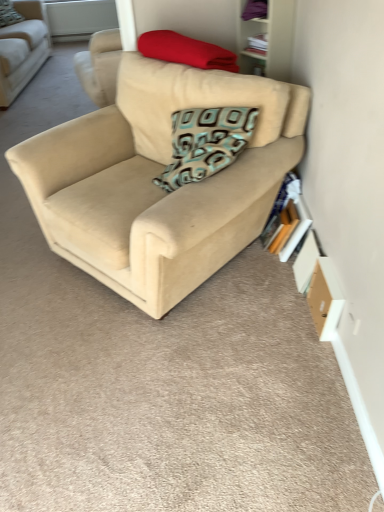
Describe the element at coordinates (186, 51) in the screenshot. This screenshot has width=384, height=512. I see `matte red blanket at upper center, which appears as the 1th pillow when viewed from the front` at that location.

Measure the distance between point (284,253) and camera.

7.11 feet.

At what (x,y) coordinates should I click in order to perform the action: click on beige fabric couch at center, acting as the first studio couch starting from the bottom. Please return your answer as a coordinate pair (x, y). The width and height of the screenshot is (384, 512). Looking at the image, I should click on (148, 204).

This screenshot has height=512, width=384. I want to click on matte red blanket at upper center, which appears as the 1th pillow when viewed from the front, so click(x=186, y=51).

From the image's perspective, is beige fabric couch at center, the first studio couch in the back-to-front sequence, over wooden bookshelf at upper right?

Yes, from the image's perspective, beige fabric couch at center, the first studio couch in the back-to-front sequence, is above wooden bookshelf at upper right.

Which of these two, beige fabric couch at center, the first studio couch positioned from the top, or wooden bookshelf at upper right, is bigger?

beige fabric couch at center, the first studio couch positioned from the top.

Is beige fabric couch at center, which is the 1th studio couch from left to right, to the left of wooden bookshelf at upper right from the viewer's perspective?

Yes, beige fabric couch at center, which is the 1th studio couch from left to right, is to the left of wooden bookshelf at upper right.

In the image, is beige fabric couch at center, which is the 1th studio couch from left to right, positioned in front of or behind wooden bookshelf at upper right?

Clearly, beige fabric couch at center, which is the 1th studio couch from left to right, is behind wooden bookshelf at upper right.

Does teal patterned pillow at upper center, the first pillow from the back, have a larger size compared to beige fabric couch at center, the first studio couch in the back-to-front sequence?

No.

Is point (20, 20) more distant than point (39, 53)?

That is True.

Which is behind, teal patterned pillow at upper center, which is counted as the second pillow, starting from the right, or beige fabric couch at center, the second studio couch from the bottom?

teal patterned pillow at upper center, which is counted as the second pillow, starting from the right, is further from the camera.

From a real-world perspective, between teal patterned pillow at upper center, which is the 1th pillow from top to bottom, and beige fabric couch at center, which is the 1th studio couch from left to right, who is vertically lower?

beige fabric couch at center, which is the 1th studio couch from left to right.

Identify the location of the 2nd pillow counting from the left of the hardcover book at right. This screenshot has height=512, width=384. (9, 14).

Is teal patterned pillow at upper center, which is the 1th pillow from top to bottom, positioned before hardcover book at right?

No, it is behind hardcover book at right.

Is point (23, 18) more distant than point (283, 254)?

Yes, point (23, 18) is behind point (283, 254).

Is teal patterned pillow at upper center, which ranks as the 2th pillow in front-to-back order, to the left or to the right of hardcover book at right in the image?

From the image, it's evident that teal patterned pillow at upper center, which ranks as the 2th pillow in front-to-back order, is to the left of hardcover book at right.

From the image's perspective, would you say beige fabric couch at center, acting as the first studio couch starting from the bottom, is shown under matte red blanket at upper center, which is the 1th pillow in right-to-left order?

Yes, from the image's perspective, beige fabric couch at center, acting as the first studio couch starting from the bottom, is beneath matte red blanket at upper center, which is the 1th pillow in right-to-left order.

Does beige fabric couch at center, which appears as the 2th studio couch when viewed from the left, have a greater width compared to matte red blanket at upper center, which is the second pillow from back to front?

Yes, beige fabric couch at center, which appears as the 2th studio couch when viewed from the left, is wider than matte red blanket at upper center, which is the second pillow from back to front.

Considering the relative positions of beige fabric couch at center, which appears as the 2th studio couch when viewed from the left, and matte red blanket at upper center, which is the second pillow from back to front, in the image provided, is beige fabric couch at center, which appears as the 2th studio couch when viewed from the left, behind matte red blanket at upper center, which is the second pillow from back to front,?

No, beige fabric couch at center, which appears as the 2th studio couch when viewed from the left, is closer to the camera.

Considering the relative positions of matte red blanket at upper center, which is the 1th pillow in right-to-left order, and wooden bookshelf at upper right in the image provided, is matte red blanket at upper center, which is the 1th pillow in right-to-left order, to the left of wooden bookshelf at upper right from the viewer's perspective?

Indeed, matte red blanket at upper center, which is the 1th pillow in right-to-left order, is positioned on the left side of wooden bookshelf at upper right.

Is the depth of matte red blanket at upper center, which ranks as the first pillow in bottom-to-top order, greater than that of wooden bookshelf at upper right?

No, matte red blanket at upper center, which ranks as the first pillow in bottom-to-top order, is in front of wooden bookshelf at upper right.

Is point (170, 53) behind point (253, 60)?

No, (170, 53) is closer to viewer.

Would you say teal patterned pillow at upper center, which is counted as the second pillow, starting from the right, is part of white plastic window screen at upper center's contents?

That's incorrect, teal patterned pillow at upper center, which is counted as the second pillow, starting from the right, is not inside white plastic window screen at upper center.

From the image's perspective, which one is positioned higher, white plastic window screen at upper center or teal patterned pillow at upper center, positioned as the second pillow in bottom-to-top order?

white plastic window screen at upper center appears higher in the image.

Considering the sizes of objects white plastic window screen at upper center and teal patterned pillow at upper center, which ranks as the 2th pillow in front-to-back order, in the image provided, who is taller, white plastic window screen at upper center or teal patterned pillow at upper center, which ranks as the 2th pillow in front-to-back order,?

With more height is white plastic window screen at upper center.

Is white plastic window screen at upper center smaller than teal patterned pillow at upper center, which ranks as the 2th pillow in front-to-back order?

Actually, white plastic window screen at upper center might be larger than teal patterned pillow at upper center, which ranks as the 2th pillow in front-to-back order.

Can you confirm if hardcover book at right is wider than white plastic window screen at upper center?

Yes.

Considering the positions of objects hardcover book at right and white plastic window screen at upper center in the image provided, who is more to the right, hardcover book at right or white plastic window screen at upper center?

hardcover book at right.

The height and width of the screenshot is (512, 384). In order to click on book below the white plastic window screen at upper center (from a real-world perspective) in this screenshot , I will do `click(287, 220)`.

Where is `bookshelf above the beige fabric couch at center, placed as the second studio couch when sorted from right to left (from a real-world perspective)`? The width and height of the screenshot is (384, 512). bookshelf above the beige fabric couch at center, placed as the second studio couch when sorted from right to left (from a real-world perspective) is located at coordinates (269, 40).

From the teal patterned pillow at upper center, which is counted as the second pillow, starting from the right, count 1st studio couch to the right and point to it. Please provide its 2D coordinates.

[(22, 50)]

When comparing their distances from hardcover book at right, does beige fabric couch at center, which is counted as the 2th studio couch, starting from the front, or matte red blanket at upper center, the 2th pillow in the left-to-right sequence, seem further?

beige fabric couch at center, which is counted as the 2th studio couch, starting from the front, is positioned further to the anchor hardcover book at right.

Based on their spatial positions, is white plastic window screen at upper center or matte red blanket at upper center, marked as the 2th pillow in a top-to-bottom arrangement, further from beige fabric couch at center, acting as the first studio couch starting from the bottom?

white plastic window screen at upper center.

Considering their positions, is beige fabric couch at center, the first studio couch positioned from the top, positioned closer to beige fabric couch at center, the second studio couch from the top, than teal patterned pillow at upper center, the first pillow from the back?

beige fabric couch at center, the first studio couch positioned from the top, is positioned closer to the anchor beige fabric couch at center, the second studio couch from the top.

Considering their positions, is white plastic window screen at upper center positioned closer to beige fabric couch at center, the second studio couch from the top, than beige fabric couch at center, the first studio couch in the back-to-front sequence?

beige fabric couch at center, the first studio couch in the back-to-front sequence.

Estimate the real-world distances between objects in this image. Which object is closer to beige fabric couch at center, acting as the first studio couch starting from the bottom, teal patterned pillow at upper center, the first pillow from the back, or wooden bookshelf at upper right?

Based on the image, wooden bookshelf at upper right appears to be nearer to beige fabric couch at center, acting as the first studio couch starting from the bottom.

Based on their spatial positions, is wooden bookshelf at upper right or hardcover book at right closer to white plastic window screen at upper center?

Among the two, wooden bookshelf at upper right is located nearer to white plastic window screen at upper center.

Considering their positions, is beige fabric couch at center, which is the 1th studio couch from left to right, positioned further to wooden bookshelf at upper right than beige fabric couch at center, the second studio couch from the top?

Among the two, beige fabric couch at center, which is the 1th studio couch from left to right, is located further to wooden bookshelf at upper right.

Which object lies nearer to the anchor point hardcover book at right, beige fabric couch at center, placed as the second studio couch when sorted from right to left, or beige fabric couch at center, marked as the 1th studio couch in a front-to-back arrangement?

Based on the image, beige fabric couch at center, marked as the 1th studio couch in a front-to-back arrangement, appears to be nearer to hardcover book at right.

At what (x,y) coordinates should I click in order to perform the action: click on bookshelf between beige fabric couch at center, the first studio couch in the back-to-front sequence, and hardcover book at right, in the horizontal direction. Please return your answer as a coordinate pair (x, y). Looking at the image, I should click on (269, 40).

Locate an element on the screen. book positioned between beige fabric couch at center, the second studio couch from the top, and white plastic window screen at upper center from near to far is located at coordinates (287, 220).

Locate an element on the screen. This screenshot has width=384, height=512. book positioned between beige fabric couch at center, marked as the 1th studio couch in a front-to-back arrangement, and teal patterned pillow at upper center, the first pillow when ordered from left to right, from near to far is located at coordinates (287, 220).

Where is `studio couch between matte red blanket at upper center, which is the 1th pillow in right-to-left order, and teal patterned pillow at upper center, the first pillow from the back, in the front-back direction`? Image resolution: width=384 pixels, height=512 pixels. studio couch between matte red blanket at upper center, which is the 1th pillow in right-to-left order, and teal patterned pillow at upper center, the first pillow from the back, in the front-back direction is located at coordinates (22, 50).